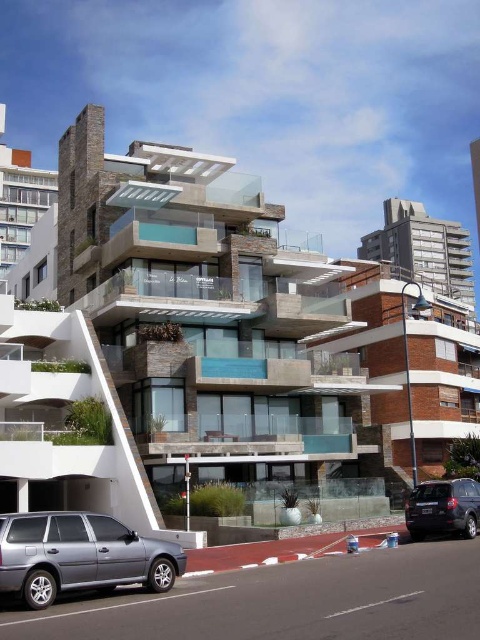
Question: Is silver metallic suv at lower left further to the viewer compared to dark gray matte suv at lower right?

Choices:
 (A) no
 (B) yes

Answer: (A)

Question: Among these objects, which one is farthest from the camera?

Choices:
 (A) silver metallic suv at lower left
 (B) dark gray matte suv at lower right

Answer: (B)

Question: Which of the following is the farthest from the observer?

Choices:
 (A) dark gray matte suv at lower right
 (B) silver metallic suv at lower left

Answer: (A)

Question: In this image, where is silver metallic suv at lower left located relative to dark gray matte suv at lower right?

Choices:
 (A) above
 (B) below

Answer: (A)

Question: Which point is closer to the camera taking this photo?

Choices:
 (A) tap(469, 528)
 (B) tap(72, 516)

Answer: (B)

Question: Can you confirm if silver metallic suv at lower left is wider than dark gray matte suv at lower right?

Choices:
 (A) no
 (B) yes

Answer: (B)